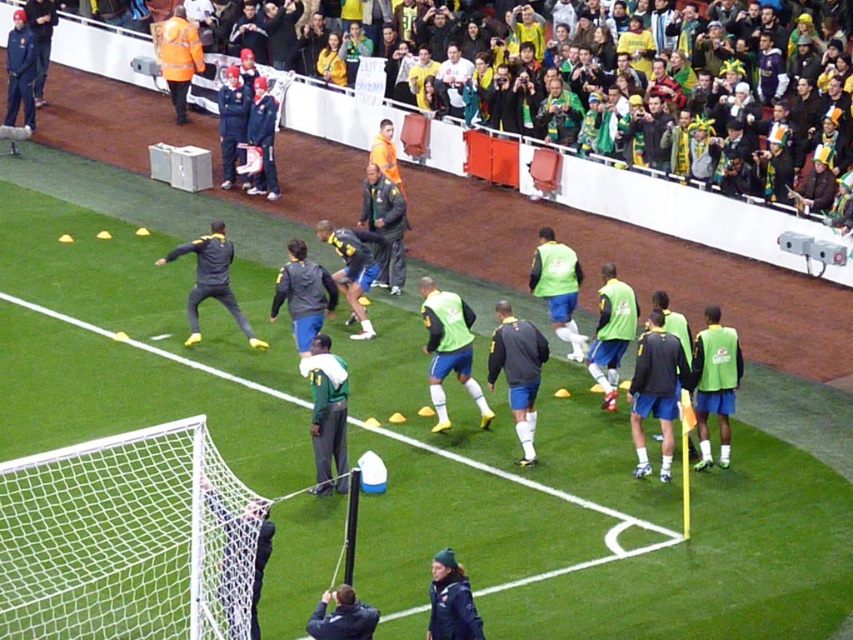
You are a soccer coach standing at the center of the field. You need to retrieve a ball that rolled into the goal area. Which object is closest to the goalpost, the white mesh net at lower left or the blue bucket near its base?

The white mesh net at lower left is closest to the goalpost as it is located at point (126, 540), which is closer than the blue bucket near its base.

You are a photographer positioned at the edge of the soccer field. You want to capture a photo that includes both the dark gray jacket at center and the dark blue jacket at upper left. Considering their sizes, which jacket will appear smaller in the photo?

The dark gray jacket at center has a lesser width compared to the dark blue jacket at upper left, so it will appear smaller in the photo.